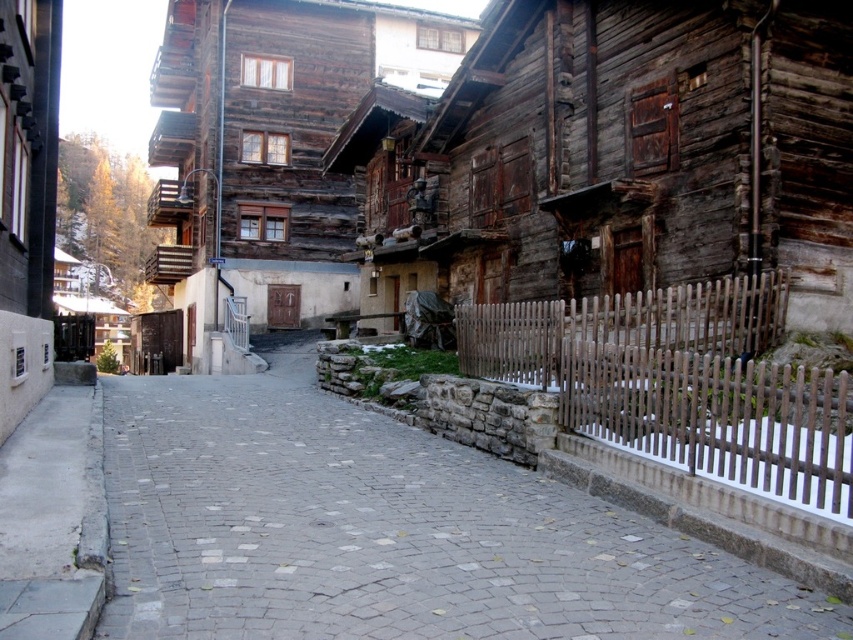
Question: Which point appears farthest from the camera in this image?

Choices:
 (A) (3, 557)
 (B) (755, 301)

Answer: (B)

Question: Considering the relative positions of gray cobblestone path at center and brown wooden fence at lower right in the image provided, where is gray cobblestone path at center located with respect to brown wooden fence at lower right?

Choices:
 (A) below
 (B) above

Answer: (A)

Question: Among these points, which one is farthest from the camera?

Choices:
 (A) (624, 328)
 (B) (4, 448)
 (C) (485, 576)

Answer: (A)

Question: Observing the image, what is the correct spatial positioning of gray cobblestone path at center in reference to brown wooden fence at lower right?

Choices:
 (A) right
 (B) left

Answer: (B)

Question: Among these points, which one is farthest from the camera?

Choices:
 (A) (466, 582)
 (B) (608, 330)
 (C) (93, 424)

Answer: (C)

Question: Can you confirm if gray cobblestone path at center is positioned to the left of brown wooden fence at lower right?

Choices:
 (A) yes
 (B) no

Answer: (A)